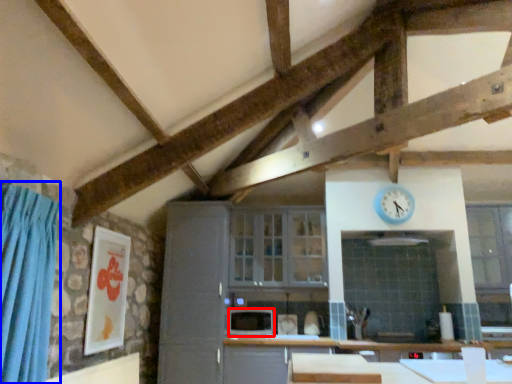
Question: Among these objects, which one is farthest to the camera, appliance (highlighted by a red box) or curtain (highlighted by a blue box)?

Choices:
 (A) appliance
 (B) curtain

Answer: (A)